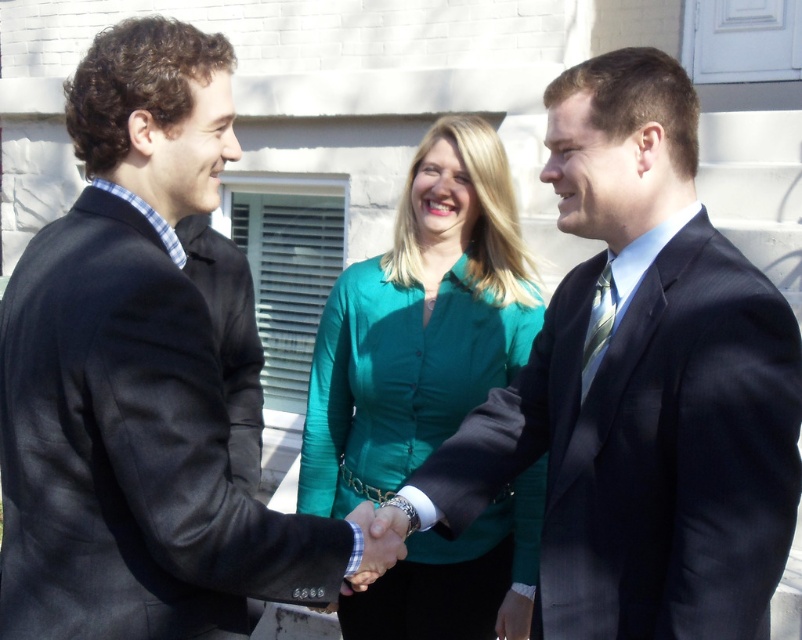
You are a photographer at a corporate event and need to capture a closeup of the black suit at center and the matte silver watch at center. Since the camera can only focus on one object at a time, which object should you focus on to ensure it appears larger in the photo?

The black suit at center is bigger than the matte silver watch at center, so focusing on the black suit at center will ensure it appears larger in the photo.

You are a photographer standing at the scene. You want to take a photo of the matte black suit at center from a distance that ensures the subject fills the frame without being too close. Considering the standard camera lens focal length of 50mm, what is the minimum distance you should maintain to avoid the subject appearing too large in the shot?

The matte black suit at center and viewer are 1.82 meters apart. To avoid the subject appearing too large, the photographer should maintain at least 1.82 meters distance using the 50mm lens.